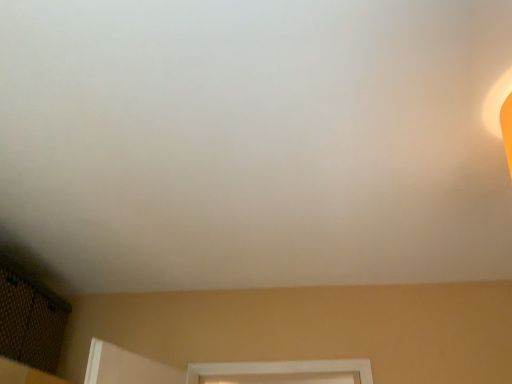
Identify the location of brown woven cabinet at lower left. The image size is (512, 384). (30, 318).

What do you see at coordinates (30, 318) in the screenshot? I see `brown woven cabinet at lower left` at bounding box center [30, 318].

Identify the location of brown woven cabinet at lower left. This screenshot has width=512, height=384. (30, 318).